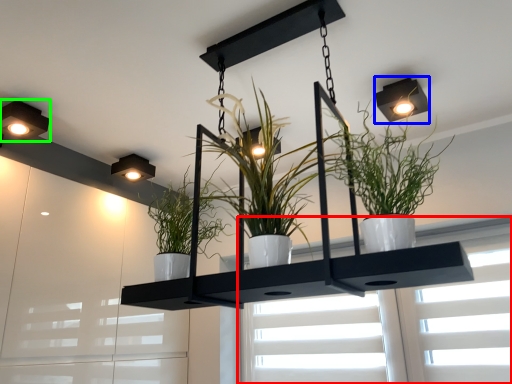
Question: Which is nearer to the window (highlighted by a red box)? light fixture (highlighted by a blue box) or lamp (highlighted by a green box).

Choices:
 (A) light fixture
 (B) lamp

Answer: (A)